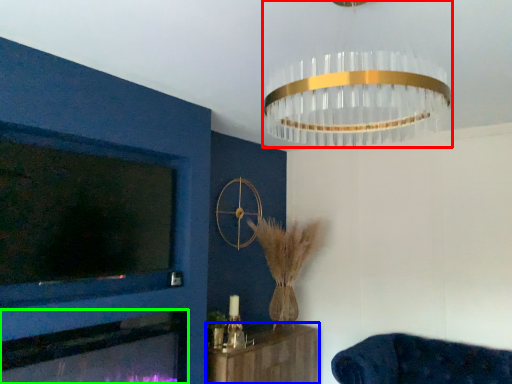
Question: Which object is positioned farthest from lamp (highlighted by a red box)? Select from furniture (highlighted by a blue box) and fireplace (highlighted by a green box).

Choices:
 (A) furniture
 (B) fireplace

Answer: (A)